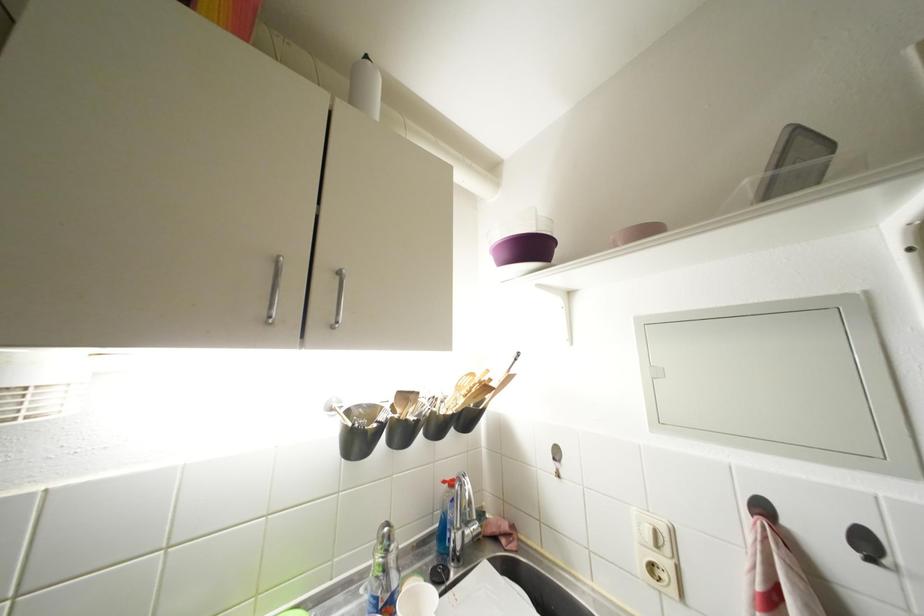
This screenshot has height=616, width=924. I want to click on white power switch, so click(653, 535).